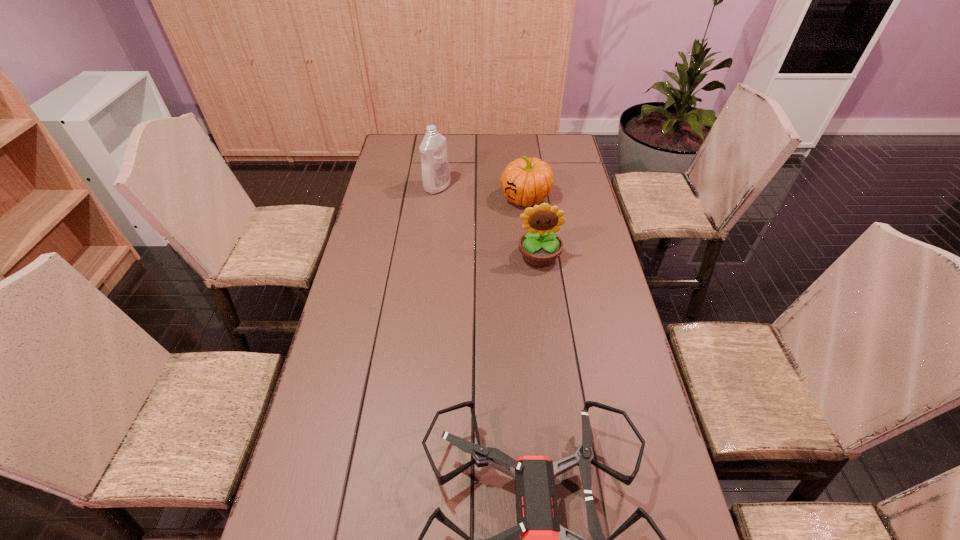
At what (x,y) coordinates should I click in order to perform the action: click on detergent. Please return your answer as a coordinate pair (x, y). Looking at the image, I should click on (433, 149).

Find the location of a particular element. the second nearest object is located at coordinates (540, 246).

At what (x,y) coordinates should I click in order to perform the action: click on the third shortest object. Please return your answer as a coordinate pair (x, y). Looking at the image, I should click on (540, 246).

The width and height of the screenshot is (960, 540). I want to click on the second shortest object, so click(528, 181).

Locate an element on the screen. This screenshot has height=540, width=960. vacant space located on the left of the detergent is located at coordinates (377, 187).

Image resolution: width=960 pixels, height=540 pixels. I want to click on vacant space located on the face of the third shortest object, so click(551, 348).

Where is `vacant space situated 0.370m on the surface of the pumpkin`? vacant space situated 0.370m on the surface of the pumpkin is located at coordinates pyautogui.click(x=405, y=198).

The width and height of the screenshot is (960, 540). I want to click on free space located 0.240m on the surface of the pumpkin, so click(438, 198).

Locate an element on the screen. The width and height of the screenshot is (960, 540). free space located on the surface of the pumpkin is located at coordinates (438, 198).

You are a GUI agent. You are given a task and a screenshot of the screen. Output one action in this format:
    pyautogui.click(x=<x>, y=<y>)
    Task: Click on the sunflower that is at the right edge
    This screenshot has width=960, height=540.
    Given the screenshot: What is the action you would take?
    click(x=540, y=246)